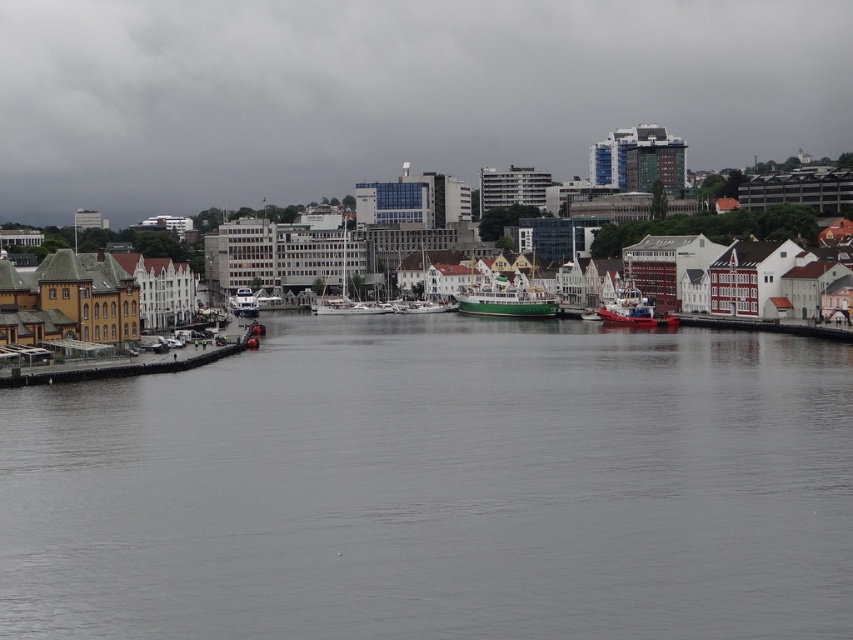
Question: Is green matte boat at center to the left of white glossy sailboat at center from the viewer's perspective?

Choices:
 (A) no
 (B) yes

Answer: (A)

Question: Is green matte boat at center positioned at the back of white glossy boat at center-left?

Choices:
 (A) yes
 (B) no

Answer: (B)

Question: Which object is positioned farthest from the green matte boat at center?

Choices:
 (A) gray water at center
 (B) white matte boat at center

Answer: (A)

Question: Which object is positioned farthest from the green matte boat at center?

Choices:
 (A) gray water at center
 (B) white glossy boat at center-left
 (C) red matte boat at right

Answer: (A)

Question: Which of the following is the closest to the observer?

Choices:
 (A) (598, 44)
 (B) (467, 298)
 (C) (469, 456)

Answer: (C)

Question: Can you confirm if green matte boat at center is positioned to the left of white glossy sailboat at center?

Choices:
 (A) no
 (B) yes

Answer: (A)